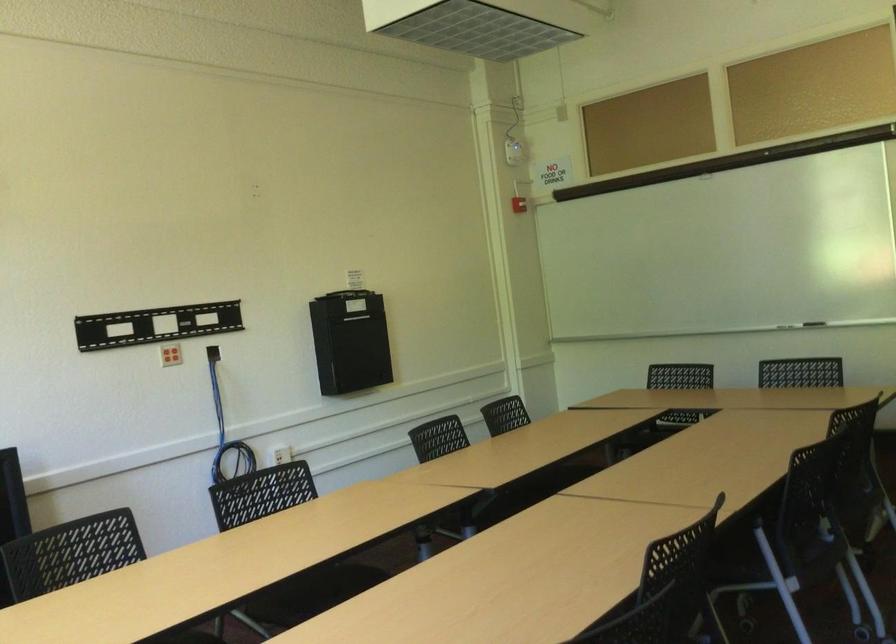
The image size is (896, 644). Describe the element at coordinates (347, 327) in the screenshot. I see `the black box handle` at that location.